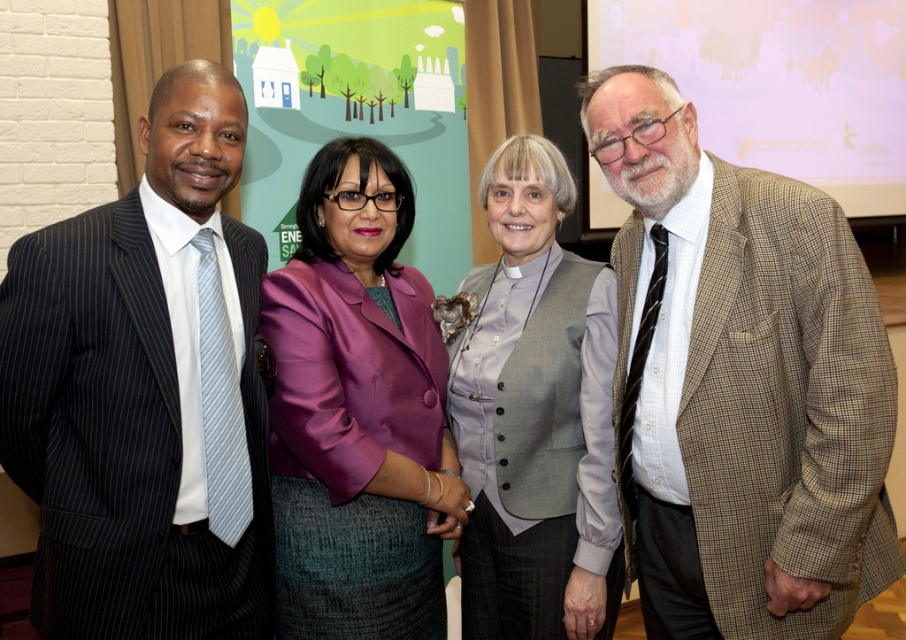
Question: Does brown checkered suit at right appear on the right side of gray buttoned vest at center?

Choices:
 (A) yes
 (B) no

Answer: (A)

Question: From the image, what is the correct spatial relationship of brown checkered suit at right in relation to purple satin blazer at center?

Choices:
 (A) above
 (B) below

Answer: (A)

Question: Which object is positioned closest to the gray buttoned vest at center?

Choices:
 (A) matte black suit at left
 (B) purple satin blazer at center

Answer: (B)

Question: Which of the following is the farthest from the observer?

Choices:
 (A) purple satin blazer at center
 (B) gray buttoned vest at center

Answer: (B)

Question: Does matte black suit at left lie in front of gray buttoned vest at center?

Choices:
 (A) no
 (B) yes

Answer: (B)

Question: Which point is closer to the camera taking this photo?

Choices:
 (A) (83, 320)
 (B) (384, 588)
 (C) (615, 566)

Answer: (A)